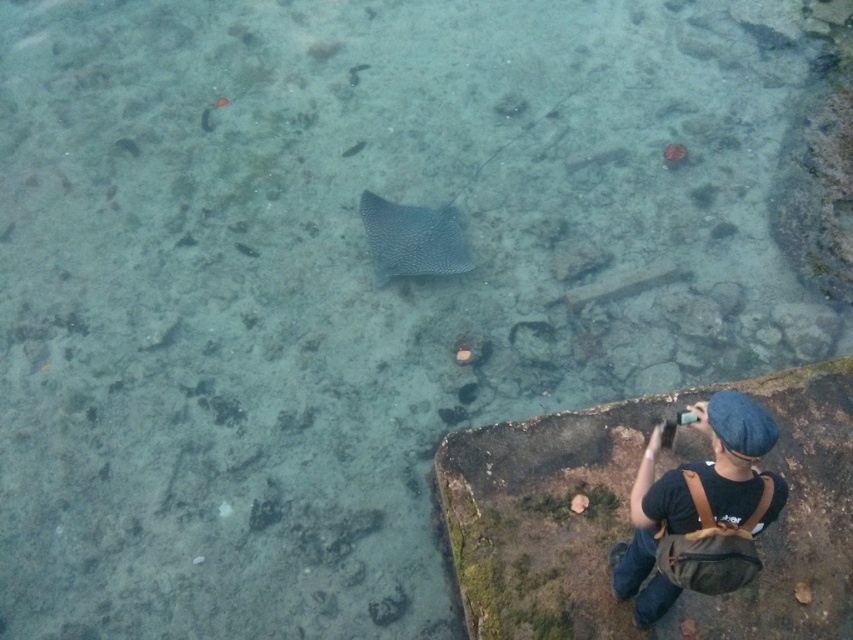
Question: Does brown leather backpack at lower right appear on the left side of leather-like gray stingray at center?

Choices:
 (A) no
 (B) yes

Answer: (A)

Question: Which of the following is the farthest from the observer?

Choices:
 (A) brown leather backpack at lower right
 (B) leather-like gray stingray at center

Answer: (B)

Question: Can you confirm if brown leather backpack at lower right is positioned to the left of leather-like gray stingray at center?

Choices:
 (A) yes
 (B) no

Answer: (B)

Question: Can you confirm if brown leather backpack at lower right is positioned below leather-like gray stingray at center?

Choices:
 (A) yes
 (B) no

Answer: (A)

Question: Which point appears closest to the camera in this image?

Choices:
 (A) (769, 444)
 (B) (421, 266)

Answer: (A)